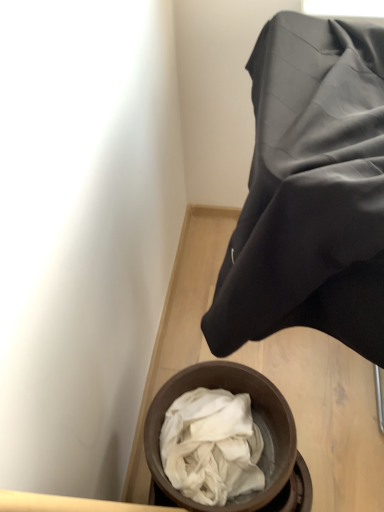
In order to face matte black fabric at upper right, should I rotate leftwards or rightwards?

A 18.033 degree turn to the right will do.

Where is `matte black fabric at upper right`? matte black fabric at upper right is located at coordinates (310, 192).

This screenshot has height=512, width=384. What do you see at coordinates (310, 192) in the screenshot? I see `matte black fabric at upper right` at bounding box center [310, 192].

Find the location of a particular element. This screenshot has width=384, height=512. matte black fabric at upper right is located at coordinates (310, 192).